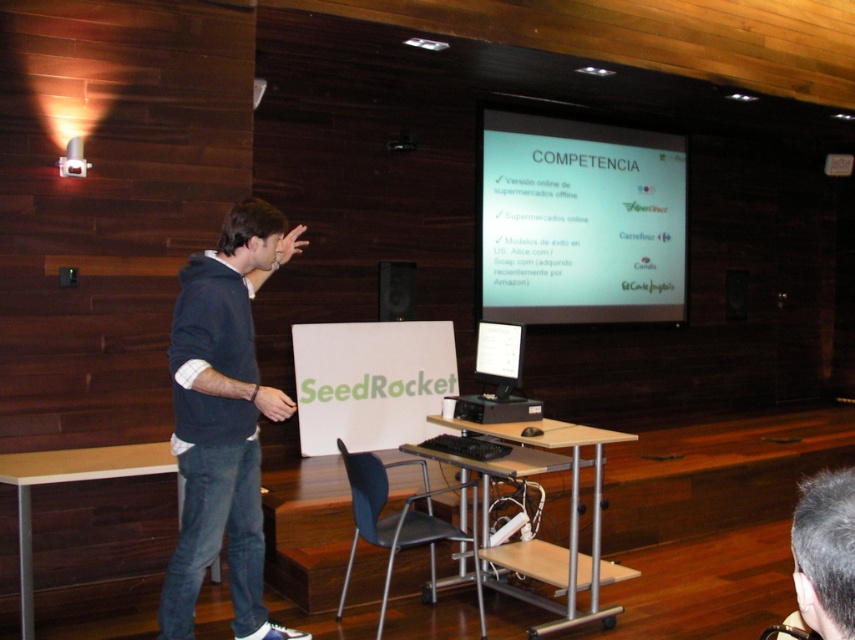
Question: Among these points, which one is nearest to the camera?

Choices:
 (A) (410, 292)
 (B) (576, 237)

Answer: (A)

Question: Does white matte projector screen at upper center appear over dark blue hoodie at left?

Choices:
 (A) yes
 (B) no

Answer: (A)

Question: Which object is the closest to the matte black speaker at upper center?

Choices:
 (A) white matte projector screen at upper center
 (B) dark blue hoodie at left

Answer: (A)

Question: Can you confirm if dark blue hoodie at left is smaller than matte black speaker at upper center?

Choices:
 (A) yes
 (B) no

Answer: (B)

Question: Is white matte projector screen at upper center in front of dark blue hoodie at left?

Choices:
 (A) yes
 (B) no

Answer: (B)

Question: Based on their relative distances, which object is nearer to the dark blue hoodie at left?

Choices:
 (A) white matte projector screen at upper center
 (B) matte black speaker at upper center

Answer: (B)